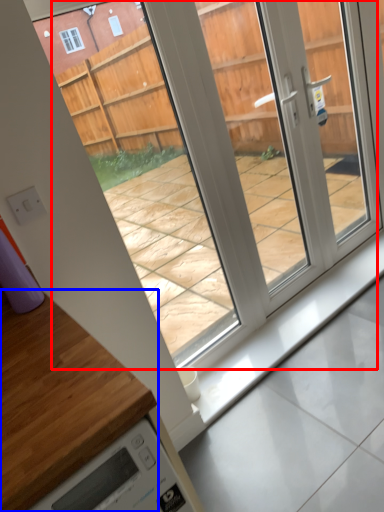
Question: Which object appears closest to the camera in this image, glass door (highlighted by a red box) or countertop (highlighted by a blue box)?

Choices:
 (A) glass door
 (B) countertop

Answer: (B)